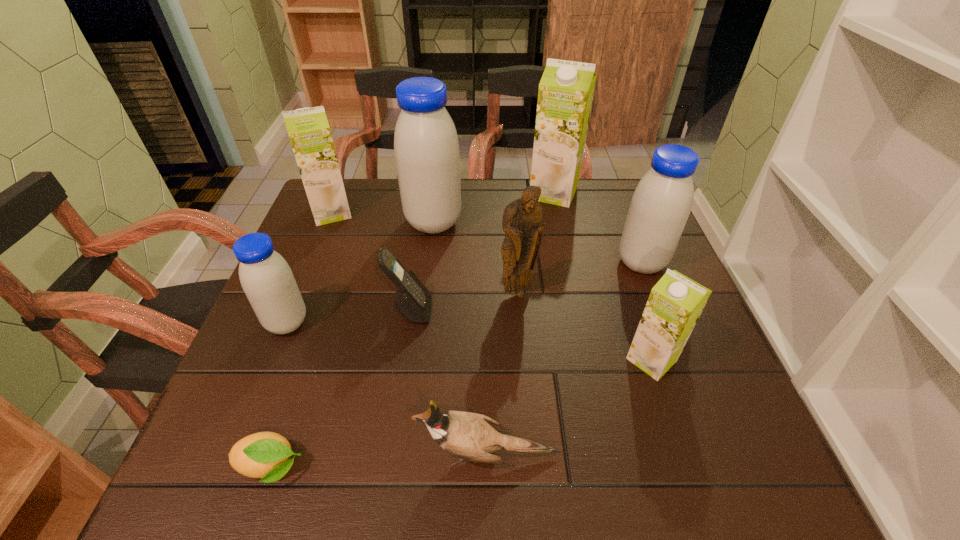
The image size is (960, 540). I want to click on the biggest green soya milk, so click(565, 95).

Locate an element on the screen. the biggest blue soya milk is located at coordinates (426, 147).

This screenshot has height=540, width=960. I want to click on the farthest blue soya milk, so point(426,147).

Locate an element on the screen. This screenshot has height=540, width=960. the second biggest green soya milk is located at coordinates (308, 129).

I want to click on the second smallest blue soya milk, so click(662, 201).

What are the coordinates of `the second nearest blue soya milk` in the screenshot? It's located at (662, 201).

The image size is (960, 540). What are the coordinates of `figurine` in the screenshot? It's located at (522, 218).

Find the location of a particular element. The width and height of the screenshot is (960, 540). the leftmost blue soya milk is located at coordinates (266, 278).

You are a GUI agent. You are given a task and a screenshot of the screen. Output one action in this format:
    pyautogui.click(x=<x>, y=<y>)
    Task: Click on the smallest blue soya milk
    This screenshot has width=960, height=540.
    Given the screenshot: What is the action you would take?
    pyautogui.click(x=266, y=278)

In order to click on the nearest green soya milk in this screenshot , I will do `click(675, 303)`.